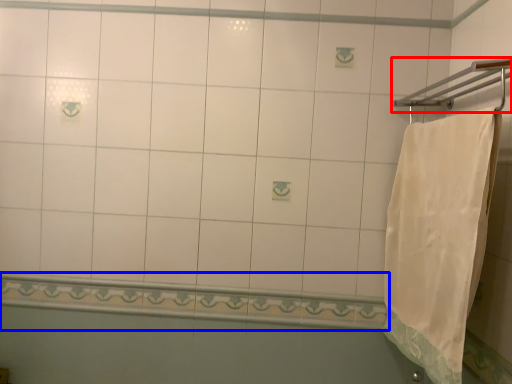
Question: Among these objects, which one is nearest to the camera, towel bar (highlighted by a red box) or balustrade (highlighted by a blue box)?

Choices:
 (A) towel bar
 (B) balustrade

Answer: (A)